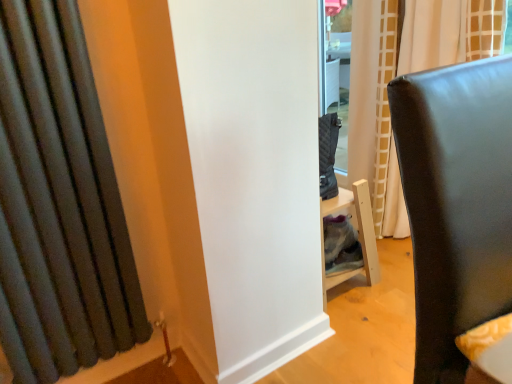
This screenshot has height=384, width=512. Describe the element at coordinates (456, 203) in the screenshot. I see `matte black chair at right` at that location.

I want to click on dark gray fabric curtain at left, marked as the 2th curtain in a right-to-left arrangement, so click(x=59, y=203).

This screenshot has height=384, width=512. In order to click on matte black chair at right in this screenshot , I will do `click(456, 203)`.

Considering the relative positions of matte white curtain at center, the second curtain viewed from the front, and matte black chair at right in the image provided, is matte white curtain at center, the second curtain viewed from the front, to the right of matte black chair at right from the viewer's perspective?

Yes, matte white curtain at center, the second curtain viewed from the front, is to the right of matte black chair at right.

Based on the photo, from a real-world perspective, which object stands above the other?

matte white curtain at center, placed as the second curtain when sorted from left to right.

From the picture: Is matte white curtain at center, which appears as the first curtain when viewed from the right, outside of matte black chair at right?

matte white curtain at center, which appears as the first curtain when viewed from the right, lies outside matte black chair at right's area.

Is matte white curtain at center, placed as the second curtain when sorted from left to right, closer to camera compared to matte black chair at right?

No, matte white curtain at center, placed as the second curtain when sorted from left to right, is behind matte black chair at right.

From a real-world perspective, is dark gray fabric curtain at left, marked as the 2th curtain in a right-to-left arrangement, physically below matte white curtain at center, arranged as the first curtain when viewed from the back?

No.

Does point (64, 194) lie behind point (403, 63)?

No, (64, 194) is in front of (403, 63).

Is dark gray fabric curtain at left, acting as the 2th curtain starting from the back, next to matte white curtain at center, which appears as the first curtain when viewed from the right?

They are not placed beside each other.

Can you confirm if dark gray fabric curtain at left, acting as the 2th curtain starting from the back, is taller than matte white curtain at center, arranged as the first curtain when viewed from the back?

No, dark gray fabric curtain at left, acting as the 2th curtain starting from the back, is not taller than matte white curtain at center, arranged as the first curtain when viewed from the back.

Are matte black chair at right and matte white curtain at center, arranged as the first curtain when viewed from the back, beside each other?

No, matte black chair at right is not next to matte white curtain at center, arranged as the first curtain when viewed from the back.

Is matte black chair at right located outside matte white curtain at center, placed as the second curtain when sorted from left to right?

Yes, matte black chair at right is not within matte white curtain at center, placed as the second curtain when sorted from left to right.

Which object is positioned more to the left, matte black chair at right or matte white curtain at center, the second curtain viewed from the front?

matte black chair at right.

Is matte white curtain at center, which appears as the first curtain when viewed from the right, at the left side of dark gray fabric curtain at left, which is the 1th curtain from front to back?

Incorrect, matte white curtain at center, which appears as the first curtain when viewed from the right, is not on the left side of dark gray fabric curtain at left, which is the 1th curtain from front to back.

Is matte white curtain at center, arranged as the first curtain when viewed from the back, facing towards dark gray fabric curtain at left, acting as the 2th curtain starting from the back?

Yes, matte white curtain at center, arranged as the first curtain when viewed from the back, is oriented towards dark gray fabric curtain at left, acting as the 2th curtain starting from the back.

Does point (355, 113) come in front of point (55, 339)?

No, it is behind (55, 339).

I want to click on curtain that appears below the matte white curtain at center, the second curtain viewed from the front (from the image's perspective), so click(59, 203).

At what (x,y) coordinates should I click in order to perform the action: click on the 1st curtain behind the matte black chair at right. Please return your answer as a coordinate pair (x, y). Looking at the image, I should click on (59, 203).

Does point (17, 101) come in front of point (432, 134)?

That is False.

Is dark gray fabric curtain at left, which is the 1th curtain from front to back, behind matte black chair at right?

Yes, it is behind matte black chair at right.

From the image's perspective, is dark gray fabric curtain at left, acting as the 2th curtain starting from the back, located beneath matte black chair at right?

Actually, dark gray fabric curtain at left, acting as the 2th curtain starting from the back, appears above matte black chair at right in the image.

Between matte black chair at right and dark gray fabric curtain at left, which is the 1th curtain from front to back, which one has larger size?

matte black chair at right is bigger.

Is matte black chair at right positioned far away from dark gray fabric curtain at left, acting as the 2th curtain starting from the back?

No, matte black chair at right is not far away from dark gray fabric curtain at left, acting as the 2th curtain starting from the back.

In the image, is matte black chair at right positioned in front of or behind dark gray fabric curtain at left, which is the 1th curtain from front to back?

matte black chair at right is in front of dark gray fabric curtain at left, which is the 1th curtain from front to back.

The width and height of the screenshot is (512, 384). Find the location of `curtain on the right of matte black chair at right`. curtain on the right of matte black chair at right is located at coordinates (405, 73).

This screenshot has width=512, height=384. Identify the location of curtain above the dark gray fabric curtain at left, which is the 1th curtain from front to back (from the image's perspective). (405, 73).

When comparing their distances from dark gray fabric curtain at left, acting as the 2th curtain starting from the back, does matte white curtain at center, arranged as the first curtain when viewed from the back, or matte black chair at right seem further?

Among the two, matte white curtain at center, arranged as the first curtain when viewed from the back, is located further to dark gray fabric curtain at left, acting as the 2th curtain starting from the back.

When comparing their distances from dark gray fabric curtain at left, which is the 1th curtain from front to back, does matte black chair at right or matte white curtain at center, arranged as the first curtain when viewed from the back, seem further?

Among the two, matte white curtain at center, arranged as the first curtain when viewed from the back, is located further to dark gray fabric curtain at left, which is the 1th curtain from front to back.

Based on their spatial positions, is matte white curtain at center, the second curtain viewed from the front, or dark gray fabric curtain at left, marked as the 1th curtain in a left-to-right arrangement, closer to matte black chair at right?

dark gray fabric curtain at left, marked as the 1th curtain in a left-to-right arrangement.

Looking at this image, estimate the real-world distances between objects in this image. Which object is closer to matte white curtain at center, which appears as the first curtain when viewed from the right, dark gray fabric curtain at left, which is the 1th curtain from front to back, or matte black chair at right?

Based on the image, matte black chair at right appears to be nearer to matte white curtain at center, which appears as the first curtain when viewed from the right.

Looking at the image, which one is located closer to matte white curtain at center, the second curtain viewed from the front, matte black chair at right or dark gray fabric curtain at left, acting as the 2th curtain starting from the back?

matte black chair at right is positioned closer to the anchor matte white curtain at center, the second curtain viewed from the front.

From the image, which object appears to be farther from matte black chair at right, dark gray fabric curtain at left, acting as the 2th curtain starting from the back, or matte white curtain at center, arranged as the first curtain when viewed from the back?

Based on the image, matte white curtain at center, arranged as the first curtain when viewed from the back, appears to be further to matte black chair at right.

This screenshot has height=384, width=512. I want to click on furniture located between dark gray fabric curtain at left, marked as the 1th curtain in a left-to-right arrangement, and matte white curtain at center, arranged as the first curtain when viewed from the back, in the left-right direction, so click(x=456, y=203).